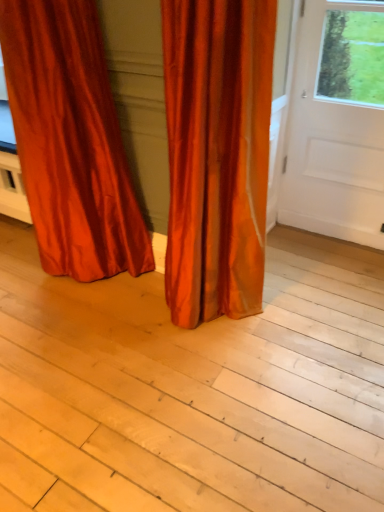
You are a GUI agent. You are given a task and a screenshot of the screen. Output one action in this format:
    pyautogui.click(x=<x>, y=<y>)
    Task: Click on the free space to the left of satin orange curtain at lower left, which ranks as the 1th curtain in left-to-right order
    
    Given the screenshot: What is the action you would take?
    pyautogui.click(x=21, y=278)